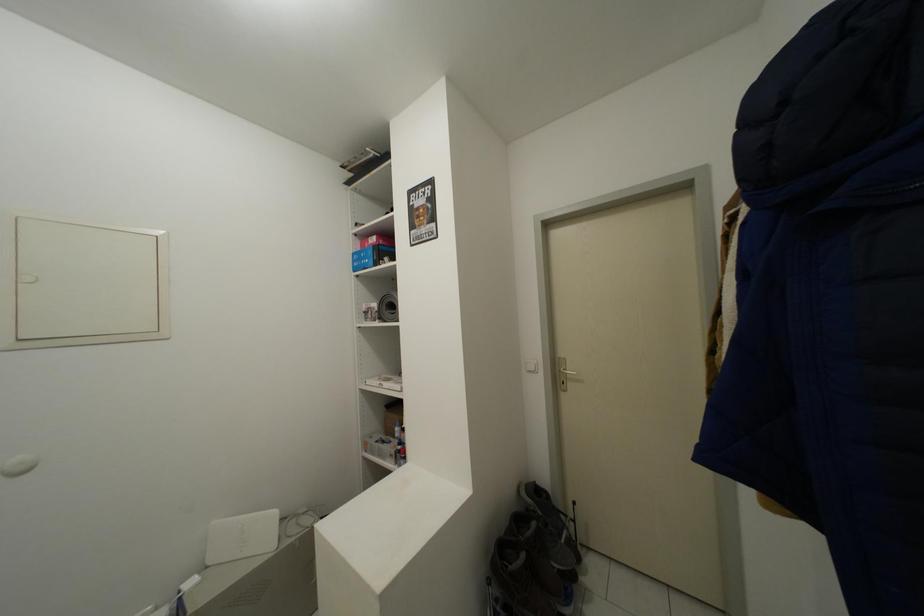
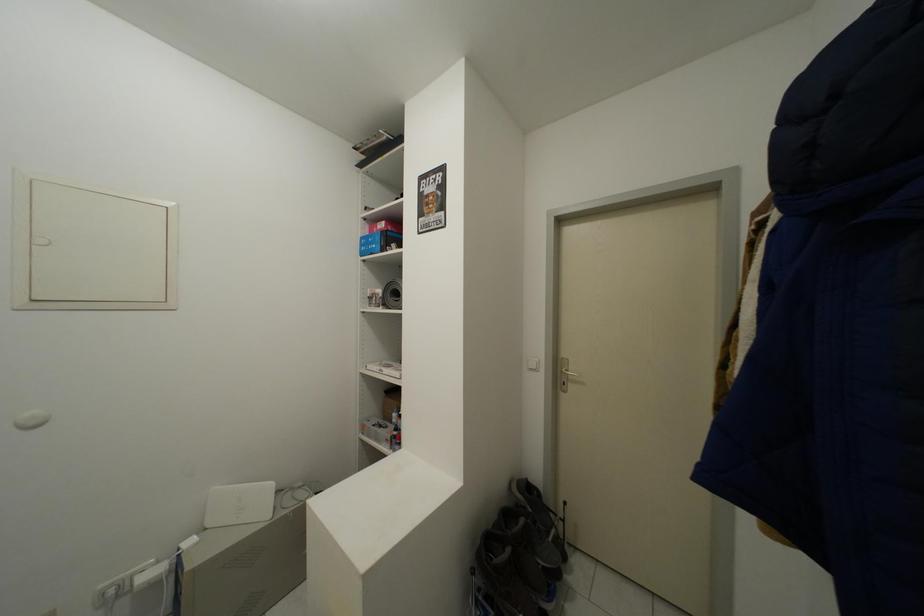
Question: The first image is from the beginning of the video and the second image is from the end. How did the camera likely rotate when shooting the video?

Choices:
 (A) Left
 (B) Right
 (C) Up
 (D) Down

Answer: (D)